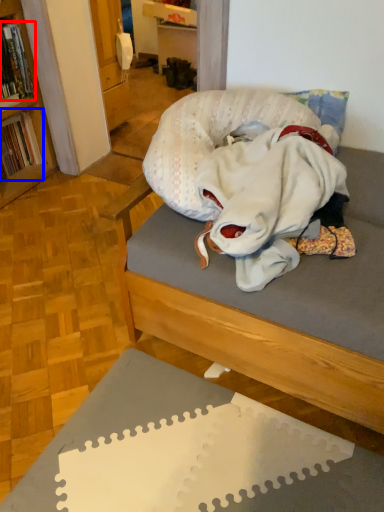
Question: Among these objects, which one is nearest to the camera, book (highlighted by a red box) or book (highlighted by a blue box)?

Choices:
 (A) book
 (B) book

Answer: (A)